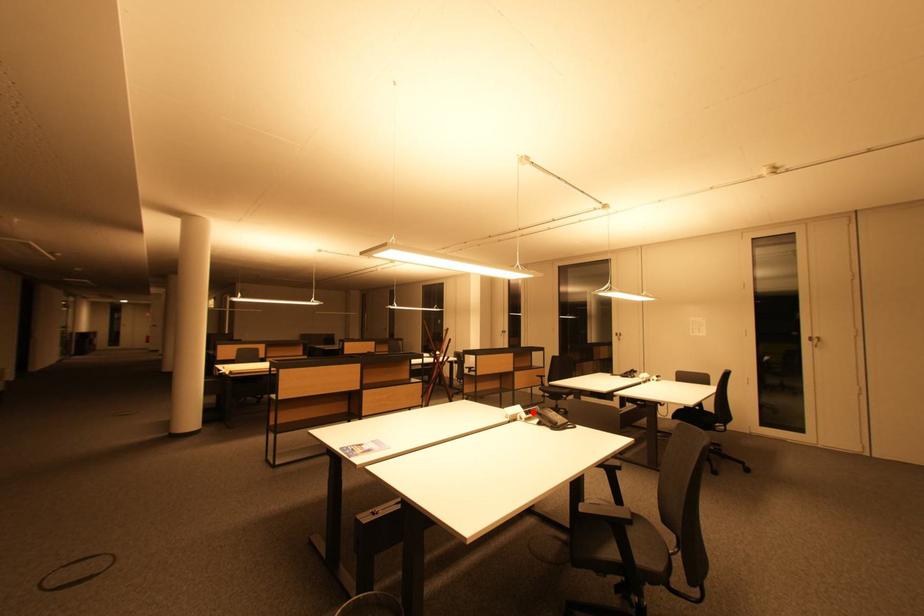
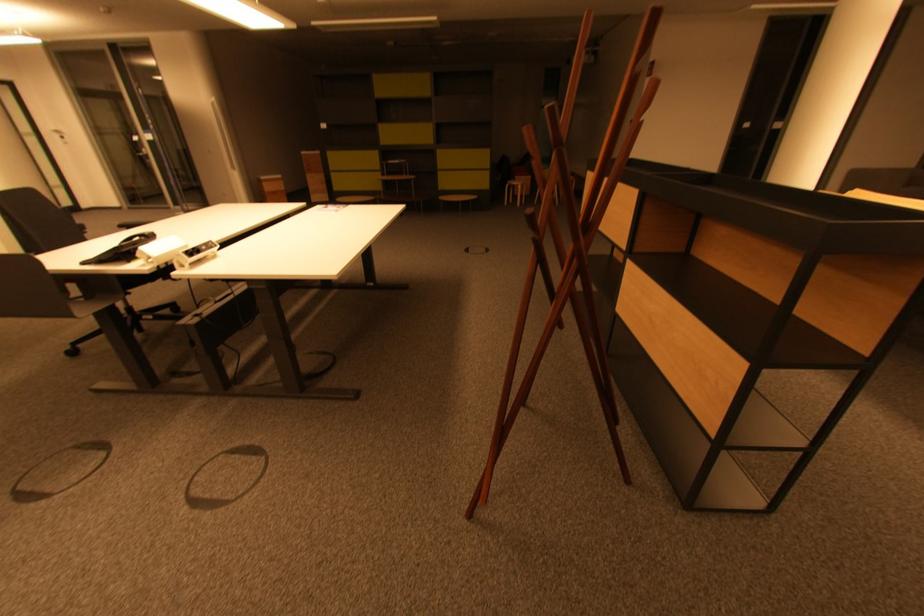
Question: I am providing you with two images of the same scene from different viewpoints. A red point is marked on the first image. At the location where the point appears in image 1, is it still visible in image 2?

Choices:
 (A) Yes
 (B) No

Answer: (B)